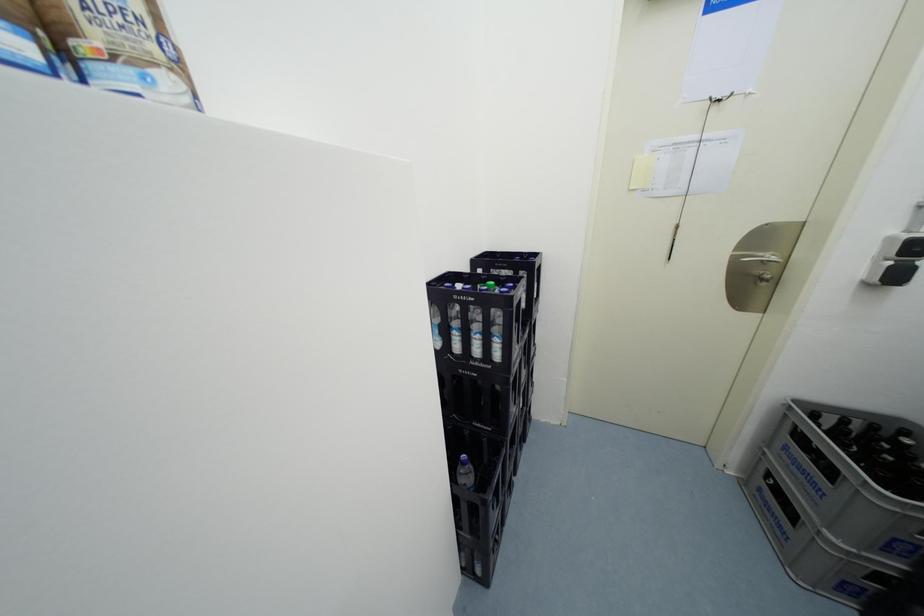
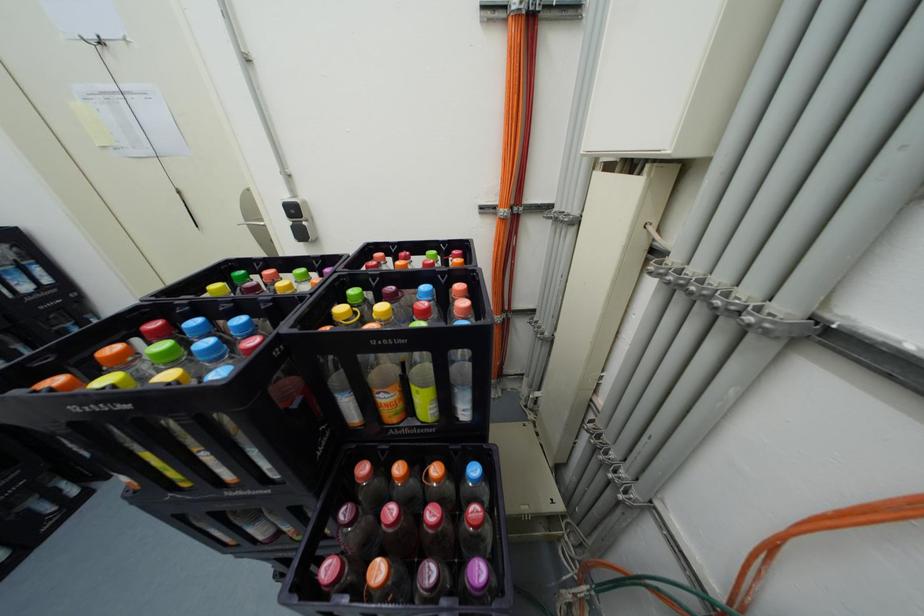
Question: Which direction would the cameraman need to move to produce the second image? Reply with the corresponding letter.

Choices:
 (A) Left
 (B) Right
 (C) Forward
 (D) Backward

Answer: (B)